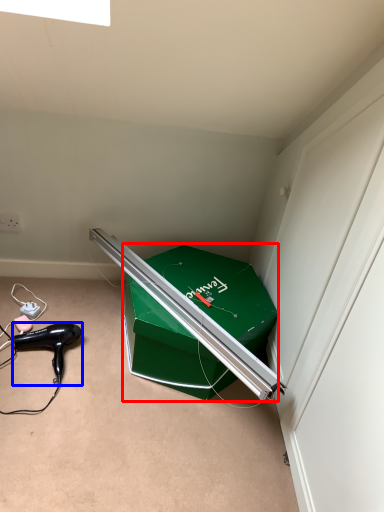
Question: Which point is closer to the camera, box (highlighted by a red box) or hair drier (highlighted by a blue box)?

Choices:
 (A) box
 (B) hair drier

Answer: (A)